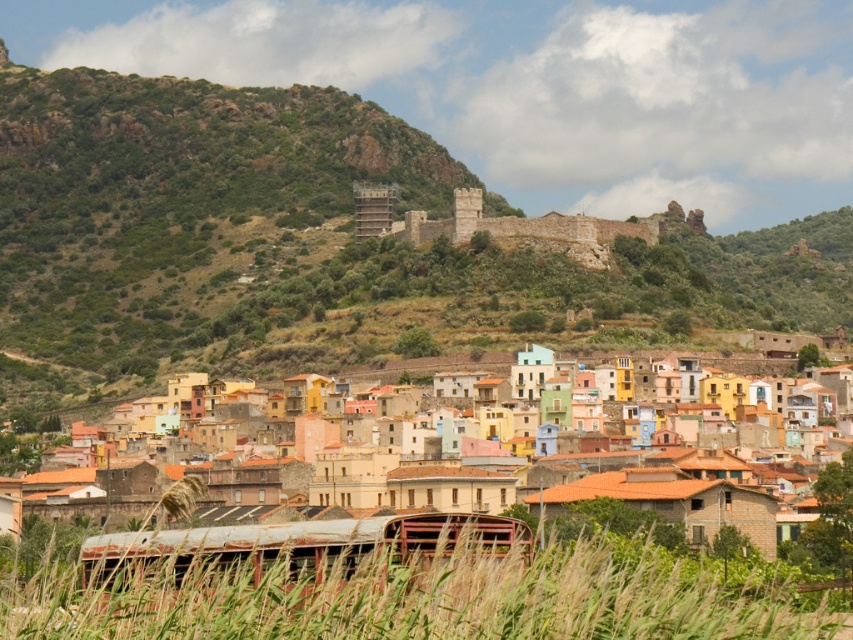
Question: Does multicolored stone village at center have a lesser width compared to rusty metal train at lower center?

Choices:
 (A) no
 (B) yes

Answer: (A)

Question: Estimate the real-world distances between objects in this image. Which object is farther from the rusty metal train at lower center?

Choices:
 (A) stone castle at center
 (B) multicolored stone village at center

Answer: (A)

Question: Which of the following is the closest to the observer?

Choices:
 (A) (166, 582)
 (B) (549, 416)

Answer: (A)

Question: Can you confirm if rusty metal train at lower center is wider than stone castle at center?

Choices:
 (A) yes
 (B) no

Answer: (B)

Question: Does multicolored stone village at center have a larger size compared to stone castle at center?

Choices:
 (A) yes
 (B) no

Answer: (B)

Question: Which point is farther to the camera?

Choices:
 (A) (767, 339)
 (B) (140, 554)
 (C) (602, 228)

Answer: (C)